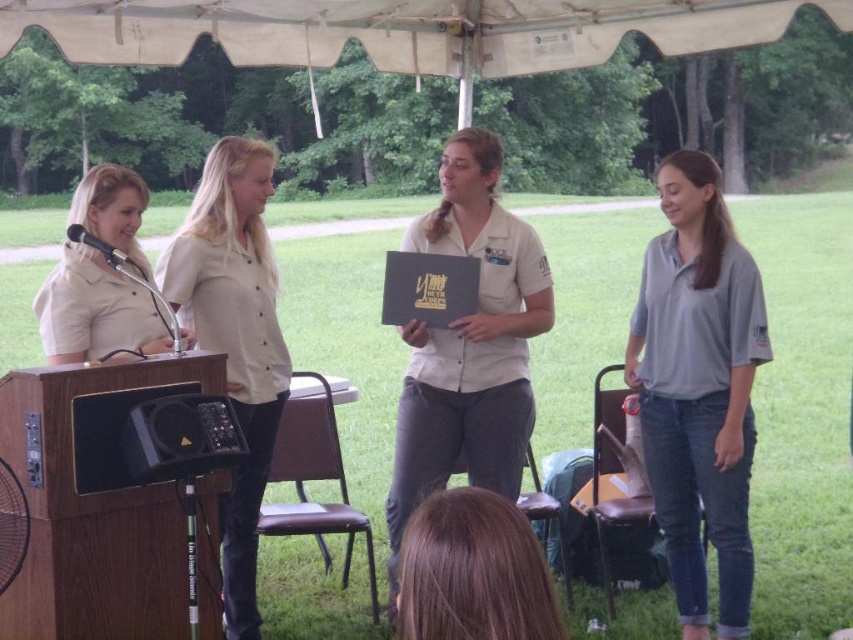
Question: Does gray cotton shirt at right appear on the right side of black leather plaque at center?

Choices:
 (A) no
 (B) yes

Answer: (B)

Question: Can you confirm if matte khaki shirt at left is positioned to the right of black plastic speaker at lower left?

Choices:
 (A) yes
 (B) no

Answer: (B)

Question: Which object is positioned farthest from the black leather plaque at center?

Choices:
 (A) matte khaki shirt at left
 (B) matte white shirt at center

Answer: (A)

Question: Which point is farther to the camera?

Choices:
 (A) black leather plaque at center
 (B) matte khaki shirt at left
 (C) matte white blouse at center

Answer: (A)

Question: Which of these objects is positioned farthest from the matte white blouse at center?

Choices:
 (A) black leather plaque at center
 (B) white fabric canopy at upper center

Answer: (B)

Question: Is brown hair at lower center bigger than matte black microphone at left?

Choices:
 (A) yes
 (B) no

Answer: (B)